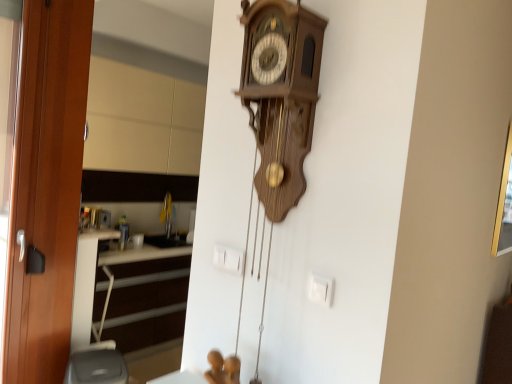
Question: Is white plastic electric outlet at center wider than gold metallic picture frame at upper right?

Choices:
 (A) yes
 (B) no

Answer: (B)

Question: Is white plastic electric outlet at center turned away from gold metallic picture frame at upper right?

Choices:
 (A) yes
 (B) no

Answer: (A)

Question: Can you confirm if white plastic electric outlet at center is shorter than gold metallic picture frame at upper right?

Choices:
 (A) no
 (B) yes

Answer: (B)

Question: From a real-world perspective, is white plastic electric outlet at center on gold metallic picture frame at upper right?

Choices:
 (A) no
 (B) yes

Answer: (A)

Question: Is the depth of white plastic electric outlet at center greater than that of gold metallic picture frame at upper right?

Choices:
 (A) no
 (B) yes

Answer: (A)

Question: From a real-world perspective, is white plastic electric outlet at center positioned under gold metallic picture frame at upper right based on gravity?

Choices:
 (A) no
 (B) yes

Answer: (B)

Question: Is gold metallic picture frame at upper right thinner than white plastic electric outlet at center?

Choices:
 (A) yes
 (B) no

Answer: (B)

Question: Is gold metallic picture frame at upper right oriented towards white plastic electric outlet at center?

Choices:
 (A) yes
 (B) no

Answer: (B)

Question: From a real-world perspective, does gold metallic picture frame at upper right stand above white plastic electric outlet at center?

Choices:
 (A) yes
 (B) no

Answer: (A)

Question: From the image's perspective, is gold metallic picture frame at upper right below white plastic electric outlet at center?

Choices:
 (A) no
 (B) yes

Answer: (A)

Question: Does gold metallic picture frame at upper right have a smaller size compared to white plastic electric outlet at center?

Choices:
 (A) no
 (B) yes

Answer: (A)

Question: Can you confirm if gold metallic picture frame at upper right is wider than white plastic electric outlet at center?

Choices:
 (A) no
 (B) yes

Answer: (B)

Question: Can beige matte cabinet at upper left be found inside wooden door at left?

Choices:
 (A) yes
 (B) no

Answer: (B)